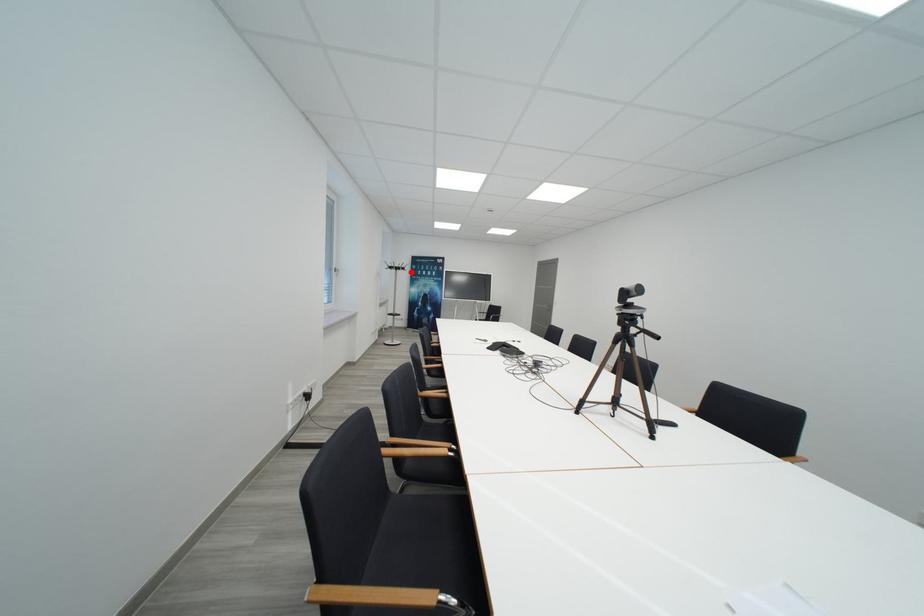
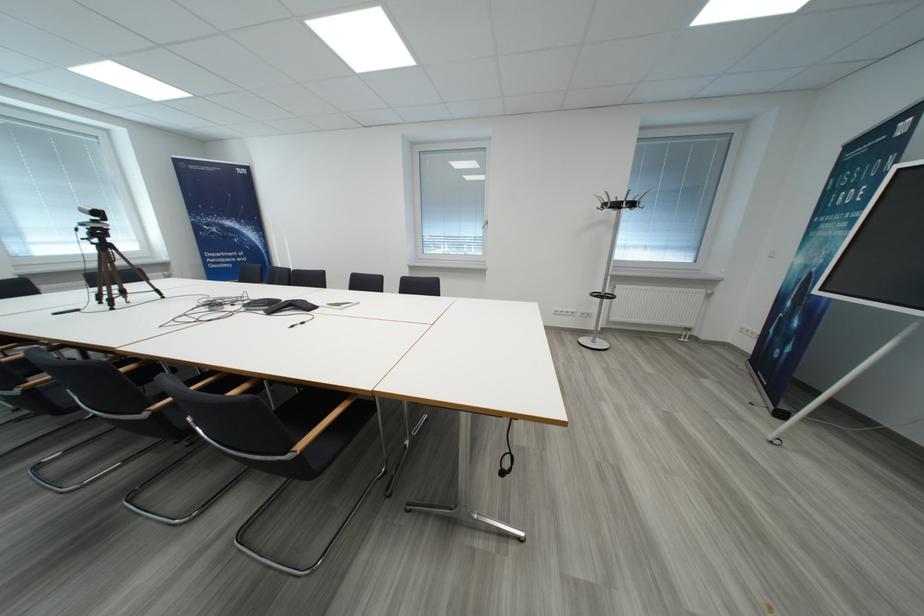
Question: I am providing you with two images of the same scene from different viewpoints. A red point is marked on the first image. At the location where the point appears in image 1, is it still visible in image 2?

Choices:
 (A) Yes
 (B) No

Answer: (A)